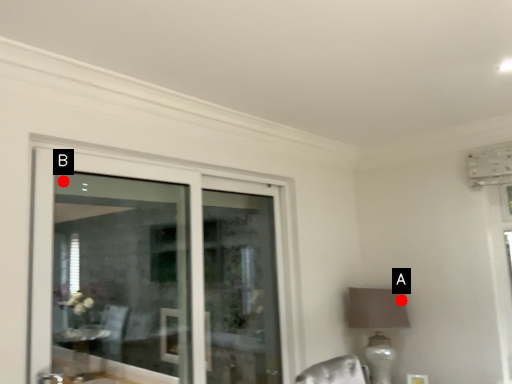
Question: Two points are circled on the image, labeled by A and B beside each circle. Which point is further to the camera?

Choices:
 (A) A is further
 (B) B is further

Answer: (A)